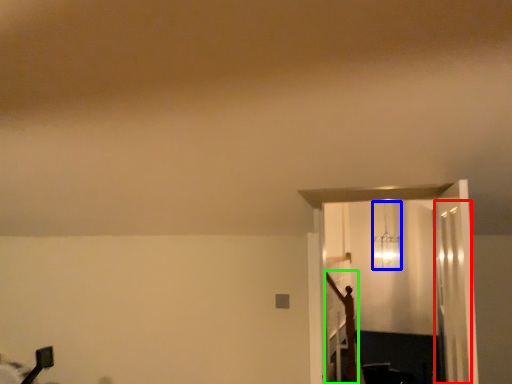
Question: Which is nearer to the glass door (highlighted by a red box)? lamp (highlighted by a blue box) or crucifix (highlighted by a green box).

Choices:
 (A) lamp
 (B) crucifix

Answer: (B)